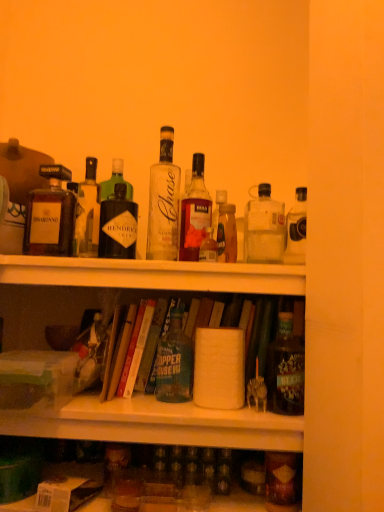
What is the approximate height of clear glass bottle at center-right, marked as the third bottle in a right-to-left arrangement?

clear glass bottle at center-right, marked as the third bottle in a right-to-left arrangement, is 9.88 inches tall.

In order to click on translucent glass bottle at center, which is the sixth bottle from left to right in this screenshot , I will do `click(227, 234)`.

Identify the location of green cardboard box at lower left, positioned as the 2th box in bottom-to-top order. This screenshot has width=384, height=512. (36, 380).

The image size is (384, 512). What are the coordinates of `clear glass bottle at center-right, marked as the third bottle in a right-to-left arrangement` in the screenshot? It's located at (x=264, y=227).

From the picture: Is matte brown bottle at left, arranged as the ninth bottle when viewed from the right, outside of clear glass bottle at center, which ranks as the third bottle in left-to-right order?

Yes, matte brown bottle at left, arranged as the ninth bottle when viewed from the right, is not within clear glass bottle at center, which ranks as the third bottle in left-to-right order.

Between matte brown bottle at left, arranged as the ninth bottle when viewed from the right, and clear glass bottle at center, which ranks as the third bottle in left-to-right order, which one is positioned behind?

matte brown bottle at left, arranged as the ninth bottle when viewed from the right.

Can you confirm if matte brown bottle at left, arranged as the ninth bottle when viewed from the right, is shorter than clear glass bottle at center, the 7th bottle viewed from the right?

Correct, matte brown bottle at left, arranged as the ninth bottle when viewed from the right, is not as tall as clear glass bottle at center, the 7th bottle viewed from the right.

Starting from the clear glass bottle at center, the 7th bottle viewed from the right, which bottle is the 1st one behind? Please provide its 2D coordinates.

[(50, 215)]

What's the angular difference between white cardboard box at lower left, placed as the 1th box when sorted from bottom to top, and white matte shelf at upper center's facing directions?

There is a 15.4-degree angle between the facing directions of white cardboard box at lower left, placed as the 1th box when sorted from bottom to top, and white matte shelf at upper center.

Considering the positions of points (54, 504) and (203, 267), is point (54, 504) farther from camera compared to point (203, 267)?

No, it is not.

From a real-world perspective, between white cardboard box at lower left, placed as the 1th box when sorted from bottom to top, and white matte shelf at upper center, who is vertically lower?

white cardboard box at lower left, placed as the 1th box when sorted from bottom to top, from a real-world perspective.

Which box is the 2nd one when counting from the front of the white matte shelf at upper center? Please provide its 2D coordinates.

[(66, 493)]

From a real-world perspective, between matte black bottle at right, placed as the first bottle when sorted from right to left, and green cardboard box at lower left, positioned as the 2th box in bottom-to-top order, who is vertically higher?

In real-world perspective, matte black bottle at right, placed as the first bottle when sorted from right to left, is above.

From the image's perspective, which object appears higher, matte black bottle at right, placed as the first bottle when sorted from right to left, or green cardboard box at lower left, positioned as the first box in top-to-bottom order?

From the image's view, matte black bottle at right, placed as the first bottle when sorted from right to left, is above.

Would you say matte black bottle at right, which ranks as the 9th bottle in left-to-right order, is outside green cardboard box at lower left, positioned as the first box in top-to-bottom order?

Yes.

Could you measure the distance between matte black bottle at right, placed as the first bottle when sorted from right to left, and green cardboard box at lower left, positioned as the first box in top-to-bottom order?

matte black bottle at right, placed as the first bottle when sorted from right to left, and green cardboard box at lower left, positioned as the first box in top-to-bottom order, are 20.47 inches apart.

Which object is further away from the camera, matte black bottle at right, placed as the first bottle when sorted from right to left, or clear glass bottle at upper left, arranged as the 8th bottle when viewed from the right?

clear glass bottle at upper left, arranged as the 8th bottle when viewed from the right, is further from the camera.

Is matte black bottle at right, placed as the first bottle when sorted from right to left, looking in the opposite direction of clear glass bottle at upper left, arranged as the 8th bottle when viewed from the right?

No, matte black bottle at right, placed as the first bottle when sorted from right to left,'s orientation is not away from clear glass bottle at upper left, arranged as the 8th bottle when viewed from the right.

How different are the orientations of matte black bottle at right, which ranks as the 9th bottle in left-to-right order, and clear glass bottle at upper left, which is the second bottle in left-to-right order, in degrees?

The angular difference between matte black bottle at right, which ranks as the 9th bottle in left-to-right order, and clear glass bottle at upper left, which is the second bottle in left-to-right order, is 0.313 degrees.

Does matte black bottle at right, placed as the first bottle when sorted from right to left, have a greater width compared to clear glass bottle at upper left, arranged as the 8th bottle when viewed from the right?

Yes.

Looking at this image, in the image, is matte brown bottle at lower right, acting as the 8th bottle starting from the left, positioned in front of or behind matte black bottle at right, placed as the first bottle when sorted from right to left?

Visually, matte brown bottle at lower right, acting as the 8th bottle starting from the left, is located in front of matte black bottle at right, placed as the first bottle when sorted from right to left.

Is matte brown bottle at lower right, acting as the 8th bottle starting from the left, not near matte black bottle at right, which ranks as the 9th bottle in left-to-right order?

They are positioned close to each other.

From the image's perspective, is matte brown bottle at lower right, the 2th bottle from the right, on matte black bottle at right, which ranks as the 9th bottle in left-to-right order?

No.

Which object is wider, matte brown bottle at lower right, the 2th bottle from the right, or matte black bottle at right, which ranks as the 9th bottle in left-to-right order?

With larger width is matte black bottle at right, which ranks as the 9th bottle in left-to-right order.

Could white matte toilet paper at center be considered to be inside white matte shelf at upper center?

No.

From the image's perspective, who appears lower, white matte shelf at upper center or white matte toilet paper at center?

white matte toilet paper at center appears lower in the image.

From a real-world perspective, between white matte shelf at upper center and white matte toilet paper at center, who is vertically higher?

white matte shelf at upper center is physically above.

What's the angular difference between white matte shelf at upper center and white matte toilet paper at center's facing directions?

white matte shelf at upper center and white matte toilet paper at center are facing 2.26 degrees away from each other.

Which is more to the right, clear glass bottle at upper left, arranged as the 8th bottle when viewed from the right, or matte brown bottle at lower right, acting as the 8th bottle starting from the left?

matte brown bottle at lower right, acting as the 8th bottle starting from the left, is more to the right.

Is clear glass bottle at upper left, which is the second bottle in left-to-right order, turned away from matte brown bottle at lower right, the 2th bottle from the right?

clear glass bottle at upper left, which is the second bottle in left-to-right order, is not turned away from matte brown bottle at lower right, the 2th bottle from the right.

Would you say clear glass bottle at upper left, which is the second bottle in left-to-right order, contains matte brown bottle at lower right, acting as the 8th bottle starting from the left?

Definitely not — matte brown bottle at lower right, acting as the 8th bottle starting from the left, is not inside clear glass bottle at upper left, which is the second bottle in left-to-right order.

Can you confirm if clear glass bottle at upper left, which is the second bottle in left-to-right order, is wider than matte brown bottle at lower right, the 2th bottle from the right?

Yes, clear glass bottle at upper left, which is the second bottle in left-to-right order, is wider than matte brown bottle at lower right, the 2th bottle from the right.

The image size is (384, 512). There is a clear glass bottle at center, the 7th bottle viewed from the right. Identify the location of the 3rd bottle below it (from a real-world perspective). click(50, 215).

Identify the location of shelf behind the white cardboard box at lower left, placed as the 1th box when sorted from bottom to top. (154, 275).

From the image, which object appears to be nearer to matte brown bottle at lower right, acting as the 8th bottle starting from the left, translucent glass bottle at center, which appears as the fifth bottle when viewed from the left, or green cardboard box at lower left, positioned as the 2th box in bottom-to-top order?

green cardboard box at lower left, positioned as the 2th box in bottom-to-top order, lies closer to matte brown bottle at lower right, acting as the 8th bottle starting from the left, than the other object.

From the picture: Based on their spatial positions, is green matte bottle at center, which is counted as the 4th bottle, starting from the left, or translucent glass bottle at center, which is the sixth bottle from left to right, further from white matte shelf at upper center?

green matte bottle at center, which is counted as the 4th bottle, starting from the left, lies further to white matte shelf at upper center than the other object.

In the scene shown: Estimate the real-world distances between objects in this image. Which object is further from green matte bottle at center, which is counted as the 4th bottle, starting from the left, matte black bottle at right, which ranks as the 9th bottle in left-to-right order, or white matte toilet paper at center?

matte black bottle at right, which ranks as the 9th bottle in left-to-right order.

When comparing their distances from matte black bottle at right, which ranks as the 9th bottle in left-to-right order, does white matte shelf at upper center or translucent glass bottle at center, which is the sixth bottle from left to right, seem further?

white matte shelf at upper center lies further to matte black bottle at right, which ranks as the 9th bottle in left-to-right order, than the other object.

Looking at the image, which one is located closer to translucent glass bottle at center, which is the sixth bottle from left to right, translucent glass bottle at center, which appears as the fifth bottle when viewed from the left, or clear glass bottle at center, which ranks as the third bottle in left-to-right order?

Based on the image, translucent glass bottle at center, which appears as the fifth bottle when viewed from the left, appears to be nearer to translucent glass bottle at center, which is the sixth bottle from left to right.

When comparing their distances from white matte shelf at upper center, does clear glass bottle at upper left, which is the second bottle in left-to-right order, or green cardboard box at lower left, positioned as the first box in top-to-bottom order, seem further?

Among the two, green cardboard box at lower left, positioned as the first box in top-to-bottom order, is located further to white matte shelf at upper center.

Looking at the image, which one is located closer to green matte bottle at center, marked as the 6th bottle in a right-to-left arrangement, translucent glass bottle at center, which is the fourth bottle from right to left, or white matte shelf at upper center?

white matte shelf at upper center lies closer to green matte bottle at center, marked as the 6th bottle in a right-to-left arrangement, than the other object.

When comparing their distances from clear glass bottle at center-right, acting as the seventh bottle starting from the left, does matte brown bottle at left, arranged as the ninth bottle when viewed from the right, or clear glass bottle at upper left, arranged as the 8th bottle when viewed from the right, seem further?

matte brown bottle at left, arranged as the ninth bottle when viewed from the right, lies further to clear glass bottle at center-right, acting as the seventh bottle starting from the left, than the other object.

What are the coordinates of `shelf located between matte brown bottle at left, arranged as the ninth bottle when viewed from the right, and clear glass bottle at center, the 7th bottle viewed from the right, in the left-right direction` in the screenshot? It's located at (154, 275).

Locate an element on the screen. The image size is (384, 512). shelf between green cardboard box at lower left, positioned as the 2th box in bottom-to-top order, and translucent glass bottle at center, placed as the fifth bottle when sorted from right to left, in the horizontal direction is located at coordinates (154, 275).

Find the location of a particular element. This screenshot has height=512, width=384. shelf that lies between translucent glass bottle at center, which appears as the fifth bottle when viewed from the left, and white cardboard box at lower left, which appears as the second box when viewed from the top, from top to bottom is located at coordinates click(x=154, y=275).

Image resolution: width=384 pixels, height=512 pixels. In order to click on toilet paper between clear glass bottle at center-right, marked as the third bottle in a right-to-left arrangement, and matte brown bottle at lower right, acting as the 8th bottle starting from the left, in the vertical direction in this screenshot , I will do `click(219, 368)`.